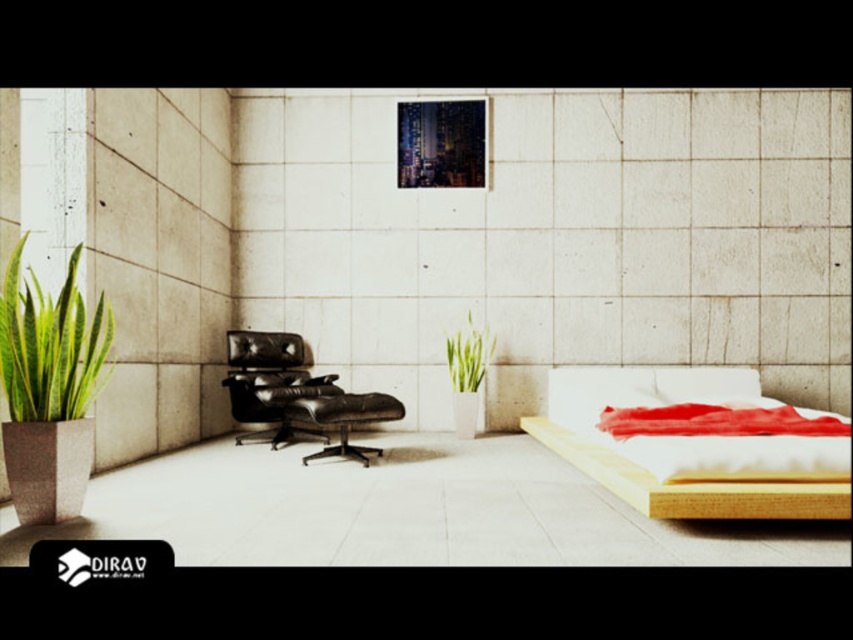
Based on the photo, you are standing in the minimalist bedroom and want to move from the entrance to the wooden bed at lower right. There is a green matte plant at center in your path. Can you walk around it without moving the plant?

The wooden bed at lower right is in front of the green matte plant at center, so you can walk around the green matte plant at center to reach the wooden bed at lower right without moving it.

You are a guest in this bedroom and want to place a new decorative item on the wooden bed at lower right. Considering the height of the bed and the white soft pillow at center, which object would be more stable for placing a tall decoration?

The wooden bed at lower right has a greater height compared to the white soft pillow at center, so placing the tall decoration on the wooden bed at lower right would be more stable.